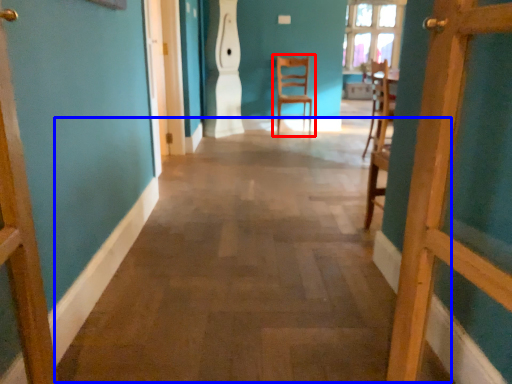
Question: Among these objects, which one is farthest to the camera, chair (highlighted by a red box) or alley (highlighted by a blue box)?

Choices:
 (A) chair
 (B) alley

Answer: (A)